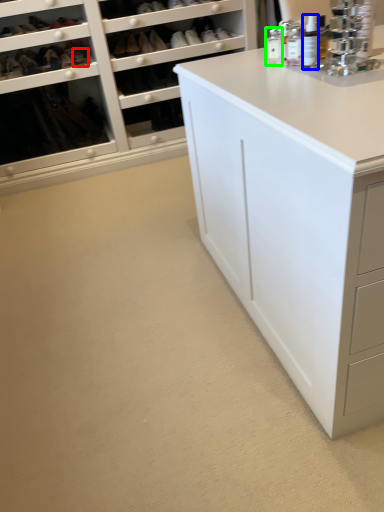
Question: Which is nearer to the shoe (highlighted by a red box)? toiletry (highlighted by a blue box) or toiletry (highlighted by a green box).

Choices:
 (A) toiletry
 (B) toiletry

Answer: (B)